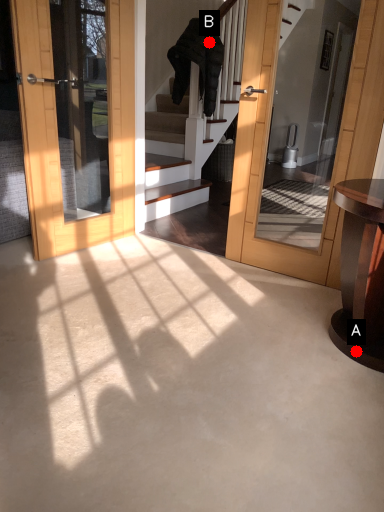
Question: Two points are circled on the image, labeled by A and B beside each circle. Among these points, which one is farthest from the camera?

Choices:
 (A) A is further
 (B) B is further

Answer: (B)